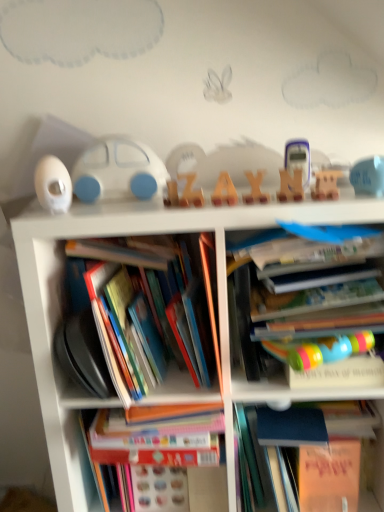
Find the location of a particular element. The height and width of the screenshot is (512, 384). free location in front of white matte toy car at center is located at coordinates (108, 206).